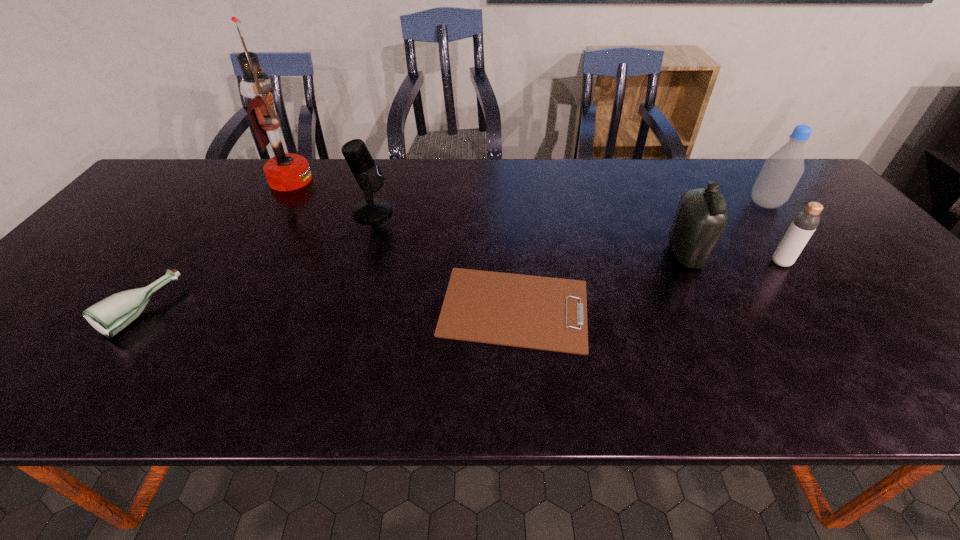
What are the coordinates of `bottle situated at the far edge` in the screenshot? It's located at (781, 172).

The image size is (960, 540). Find the location of `microphone that is at the far edge`. microphone that is at the far edge is located at coordinates (368, 175).

Locate an element on the screen. This screenshot has width=960, height=540. object that is at the right edge is located at coordinates (781, 172).

This screenshot has height=540, width=960. I want to click on object located at the far right corner, so click(781, 172).

Image resolution: width=960 pixels, height=540 pixels. What are the coordinates of `vacant space at the far edge` in the screenshot? It's located at (706, 173).

Locate an element on the screen. vacant space at the near edge is located at coordinates (250, 384).

Locate an element on the screen. vacant space at the left edge of the desktop is located at coordinates (185, 208).

I want to click on vacant region at the right edge of the desktop, so click(884, 336).

Locate an element on the screen. The height and width of the screenshot is (540, 960). blank space at the far left corner of the desktop is located at coordinates (190, 190).

You are a GUI agent. You are given a task and a screenshot of the screen. Output one action in this format:
    pyautogui.click(x=<x>, y=<y>)
    Task: Click on the blank space at the far right corner of the desktop
    
    Given the screenshot: What is the action you would take?
    pyautogui.click(x=751, y=163)